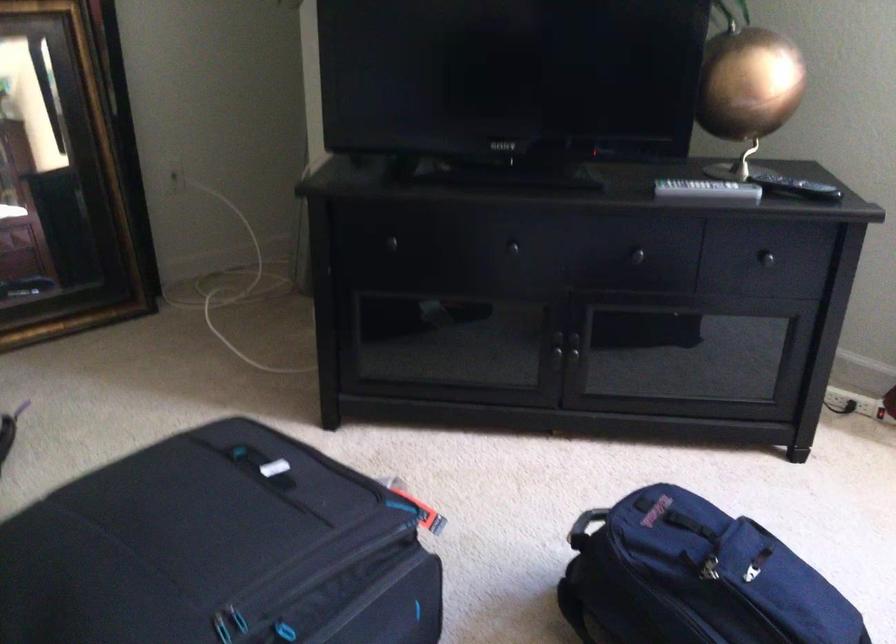
The width and height of the screenshot is (896, 644). In order to click on backpack top handle in this screenshot , I will do `click(586, 522)`.